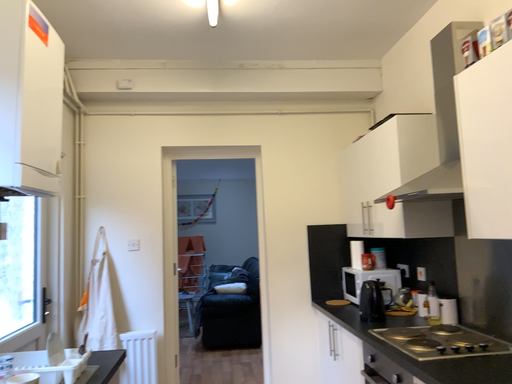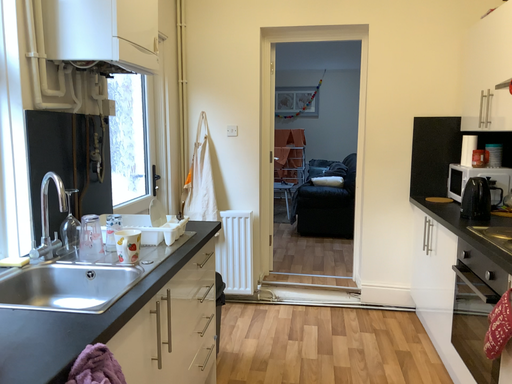
Question: Which way did the camera rotate in the video?

Choices:
 (A) rotated upward
 (B) rotated downward

Answer: (B)